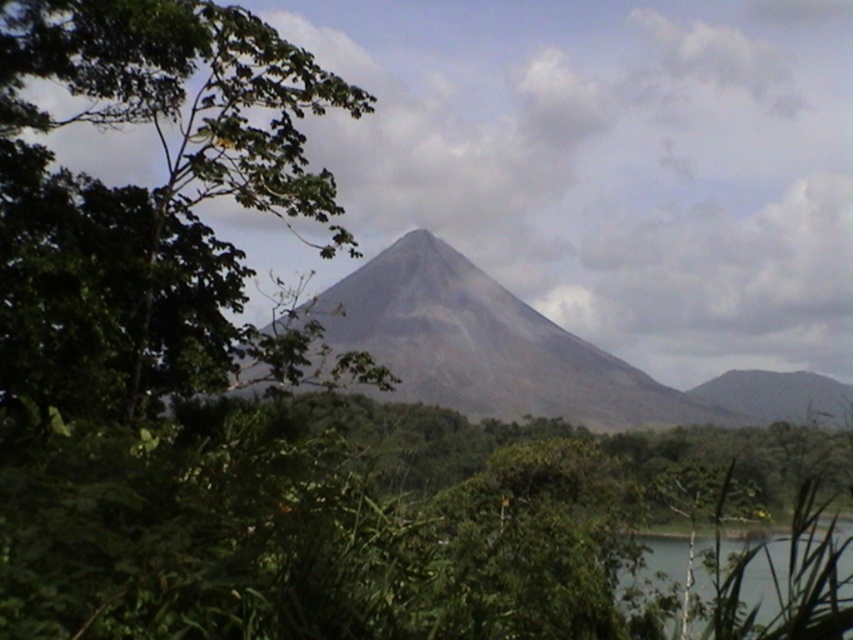
Is gray volcanic rock mountain at center taller than transparent water at lower right?

Indeed, gray volcanic rock mountain at center has a greater height compared to transparent water at lower right.

Who is more distant from viewer, (x=393, y=340) or (x=628, y=579)?

Point (x=393, y=340)

You are a GUI agent. You are given a task and a screenshot of the screen. Output one action in this format:
    pyautogui.click(x=<x>, y=<y>)
    Task: Click on the gray volcanic rock mountain at center
    
    Given the screenshot: What is the action you would take?
    pyautogui.click(x=486, y=346)

Who is more forward, (90, 116) or (328, 332)?

Positioned in front is point (90, 116).

Does green leafy tree at center appear over gray volcanic rock mountain at center?

Indeed, green leafy tree at center is positioned over gray volcanic rock mountain at center.

Who is more distant from viewer, [161,337] or [412,262]?

Positioned behind is point [412,262].

Locate an element on the screen. This screenshot has height=640, width=853. green leafy tree at center is located at coordinates (144, 192).

Who is more forward, [20,317] or [788,552]?

Point [20,317] is in front.

The height and width of the screenshot is (640, 853). Describe the element at coordinates (144, 192) in the screenshot. I see `green leafy tree at center` at that location.

Who is more distant from viewer, (41, 284) or (664, 557)?

Positioned behind is point (664, 557).

Identify the location of green leafy tree at center. The height and width of the screenshot is (640, 853). (x=144, y=192).